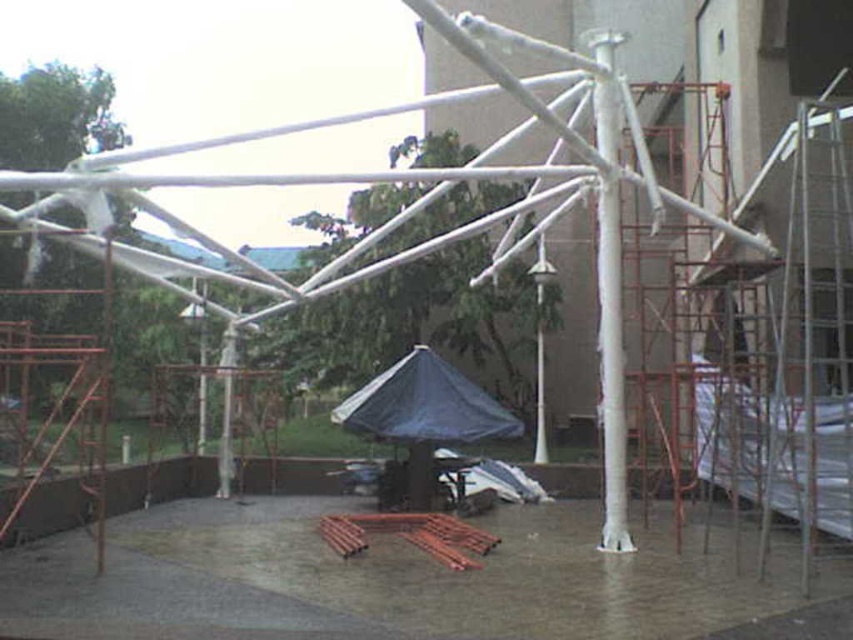
From the picture: You are an inspector checking the construction site. You notice the white plastic pole at center and the dark blue tarp at center. Which object is larger in size?

The white plastic pole at center is bigger than the dark blue tarp at center.

You are an inspector checking the construction site. You need to ensure that the white plastic pole at center is not too wide compared to the dark blue tarp at center. According to the safety guidelines, the pole should not exceed the tarp in width. Is the current setup compliant?

The white plastic pole at center is wider than dark blue tarp at center, so the setup is not compliant with safety guidelines.